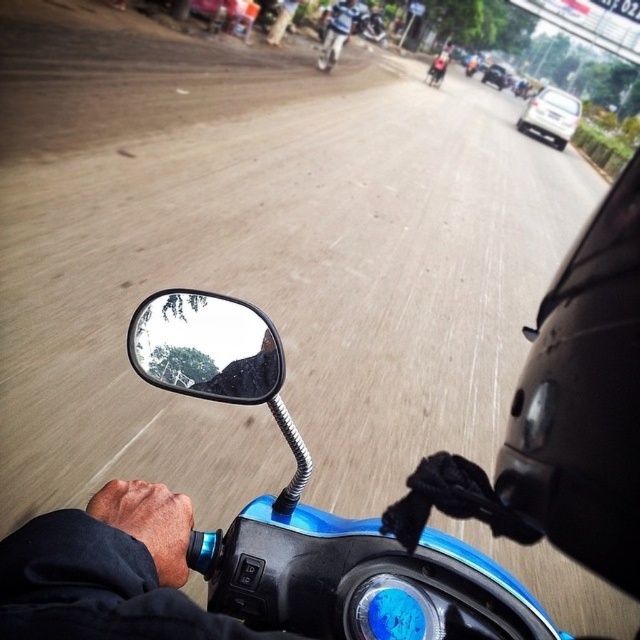
Question: Based on their relative distances, which object is farther from the black matte helmet at right?

Choices:
 (A) blue glossy helmet at upper center
 (B) glossy plastic side mirror at lower left

Answer: (A)

Question: Which point appears farthest from the camera in this image?

Choices:
 (A) (627, 282)
 (B) (346, 13)

Answer: (B)

Question: Can you confirm if black matte helmet at right is positioned below glossy plastic side mirror at lower left?

Choices:
 (A) yes
 (B) no

Answer: (A)

Question: Is the position of black matte helmet at right less distant than that of glossy plastic side mirror at lower left?

Choices:
 (A) no
 (B) yes

Answer: (A)

Question: Which of these objects is positioned closest to the black matte helmet at right?

Choices:
 (A) blue glossy helmet at upper center
 (B) glossy plastic side mirror at lower left

Answer: (B)

Question: Does black matte helmet at right appear on the left side of blue glossy helmet at upper center?

Choices:
 (A) no
 (B) yes

Answer: (A)